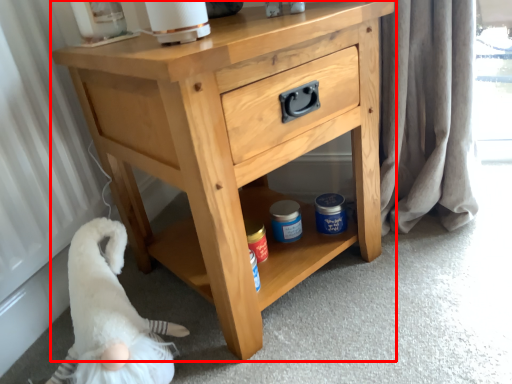
Question: From the image's perspective, what is the correct spatial relationship of chest of drawers (annotated by the red box) in relation to animal?

Choices:
 (A) above
 (B) below

Answer: (A)